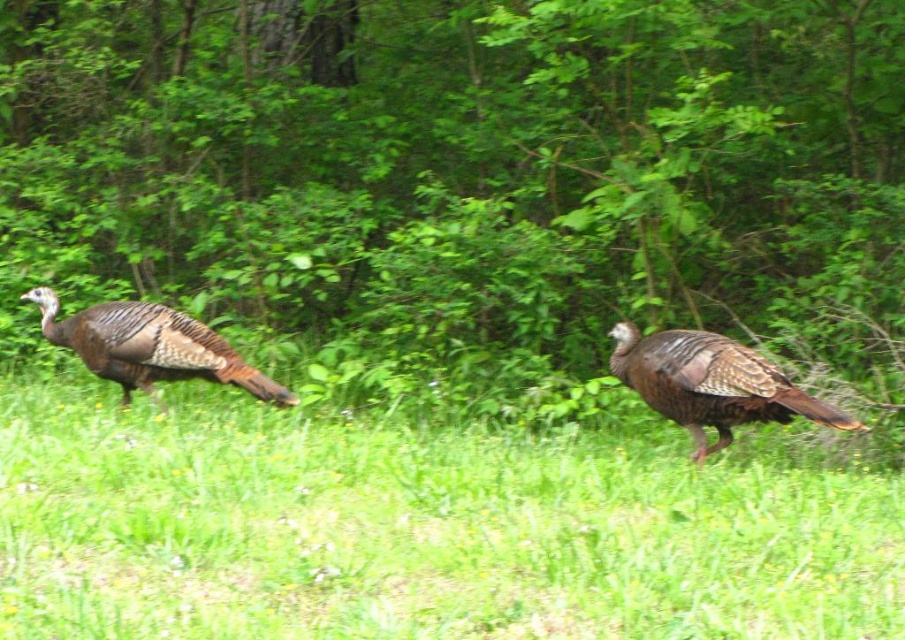
Question: Is green leafy tree at center positioned in front of green grass at center?

Choices:
 (A) no
 (B) yes

Answer: (A)

Question: Which of the following is the closest to the observer?

Choices:
 (A) (243, 476)
 (B) (149, 371)
 (C) (308, 42)

Answer: (A)

Question: Which of these objects is positioned closest to the green leafy tree at center?

Choices:
 (A) brown textured turkey at right
 (B) green grass at center
 (C) brown feathered turkey at left

Answer: (A)

Question: Can you confirm if green leafy tree at center is positioned above green grass at center?

Choices:
 (A) no
 (B) yes

Answer: (B)

Question: Does green leafy tree at center appear under brown feathered turkey at left?

Choices:
 (A) no
 (B) yes

Answer: (A)

Question: Which point is closer to the camera?

Choices:
 (A) (195, 333)
 (B) (757, 614)
 (C) (713, 397)

Answer: (B)